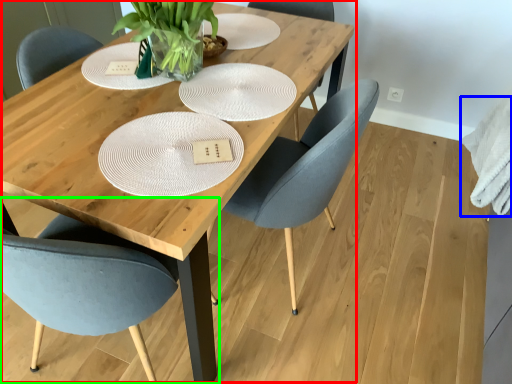
Question: Estimate the real-world distances between objects in this image. Which object is farther from table (highlighted by a red box), cloth (highlighted by a blue box) or chair (highlighted by a green box)?

Choices:
 (A) cloth
 (B) chair

Answer: (A)